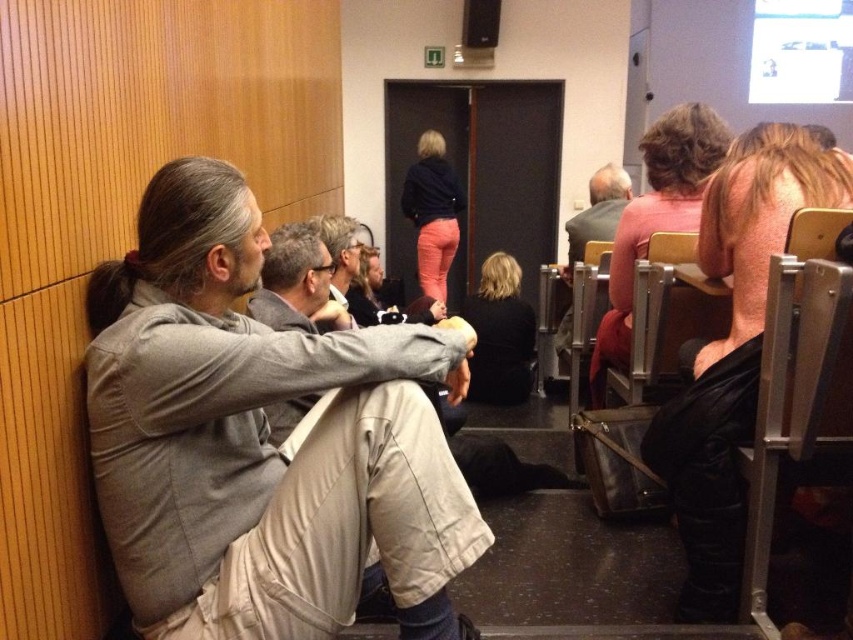
Consider the image. Is blonde hair at center above matte gray jacket at center?

No, blonde hair at center is not above matte gray jacket at center.

Can you confirm if blonde hair at center is positioned to the left of matte gray jacket at center?

In fact, blonde hair at center is to the right of matte gray jacket at center.

Find the location of `blonde hair at center`. blonde hair at center is located at coordinates (500, 333).

Who is more distant from viewer, (x=178, y=164) or (x=482, y=284)?

Positioned behind is point (x=482, y=284).

Does light gray jacket at left have a larger size compared to blonde hair at center?

Indeed, light gray jacket at left has a larger size compared to blonde hair at center.

Does point (399, 534) lie behind point (485, 308)?

No, it is in front of (485, 308).

You are a GUI agent. You are given a task and a screenshot of the screen. Output one action in this format:
    pyautogui.click(x=<x>, y=<y>)
    Task: Click on the light gray jacket at left
    The image size is (853, 640).
    Given the screenshot: What is the action you would take?
    pyautogui.click(x=260, y=440)

Between point (309, 397) and point (341, 289), which one is positioned in front?

Positioned in front is point (309, 397).

The width and height of the screenshot is (853, 640). I want to click on gray fabric jacket at center, so click(297, 284).